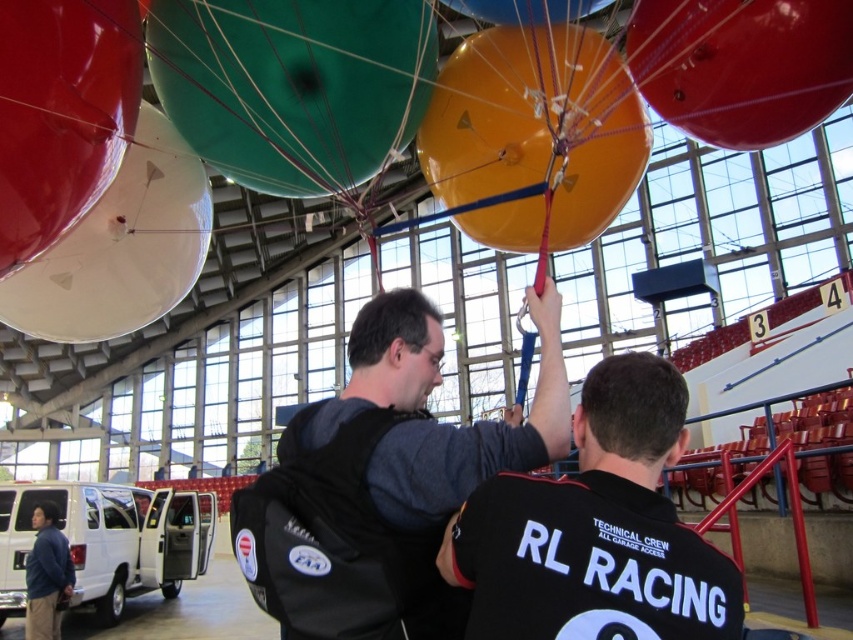
Question: Is green rubber balloon at upper center closer to camera compared to orange glossy balloon at center?

Choices:
 (A) yes
 (B) no

Answer: (A)

Question: Based on their relative distances, which object is nearer to the shiny red balloon at upper right?

Choices:
 (A) blue fabric jacket at lower left
 (B) black fabric backpack at center

Answer: (B)

Question: Which point is closer to the camera?

Choices:
 (A) (283, 12)
 (B) (616, 525)

Answer: (B)

Question: In this image, where is shiny red balloon at upper right located relative to white glossy balloon at upper left?

Choices:
 (A) above
 (B) below

Answer: (A)

Question: Does shiny metallic balloon at upper left have a lesser width compared to orange glossy balloon at upper center?

Choices:
 (A) yes
 (B) no

Answer: (B)

Question: Which point is closer to the camera taking this photo?

Choices:
 (A) (234, 177)
 (B) (576, 120)

Answer: (B)